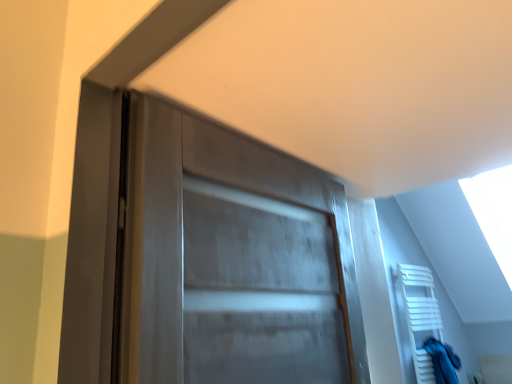
Question: From a real-world perspective, is white wooden towel rack at lower right on blue fabric at right?

Choices:
 (A) yes
 (B) no

Answer: (A)

Question: Is white wooden towel rack at lower right shorter than blue fabric at right?

Choices:
 (A) no
 (B) yes

Answer: (A)

Question: Does white wooden towel rack at lower right have a greater width compared to blue fabric at right?

Choices:
 (A) no
 (B) yes

Answer: (B)

Question: Is white wooden towel rack at lower right to the right of blue fabric at right from the viewer's perspective?

Choices:
 (A) yes
 (B) no

Answer: (B)

Question: Would you consider white wooden towel rack at lower right to be distant from blue fabric at right?

Choices:
 (A) yes
 (B) no

Answer: (B)

Question: Is blue fabric at right at the back of white wooden towel rack at lower right?

Choices:
 (A) yes
 (B) no

Answer: (A)

Question: From the image's perspective, is blue fabric at right over white wooden towel rack at lower right?

Choices:
 (A) no
 (B) yes

Answer: (A)

Question: Does blue fabric at right have a greater height compared to white wooden towel rack at lower right?

Choices:
 (A) no
 (B) yes

Answer: (A)

Question: Does blue fabric at right come in front of white wooden towel rack at lower right?

Choices:
 (A) no
 (B) yes

Answer: (A)

Question: From a real-world perspective, is blue fabric at right over white wooden towel rack at lower right?

Choices:
 (A) no
 (B) yes

Answer: (A)

Question: Can you confirm if blue fabric at right is positioned to the right of white wooden towel rack at lower right?

Choices:
 (A) no
 (B) yes

Answer: (B)

Question: From the image's perspective, does blue fabric at right appear lower than white wooden towel rack at lower right?

Choices:
 (A) no
 (B) yes

Answer: (B)

Question: Choose the correct answer: Is white wooden towel rack at lower right inside blue fabric at right or outside it?

Choices:
 (A) outside
 (B) inside

Answer: (A)